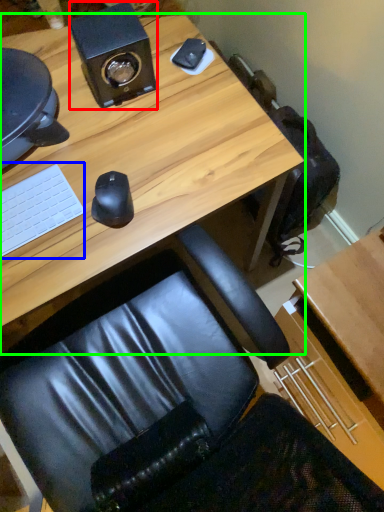
Question: Considering the real-world distances, which object is farthest from speaker (highlighted by a red box)? laptop keyboard (highlighted by a blue box) or desk (highlighted by a green box)?

Choices:
 (A) laptop keyboard
 (B) desk

Answer: (A)